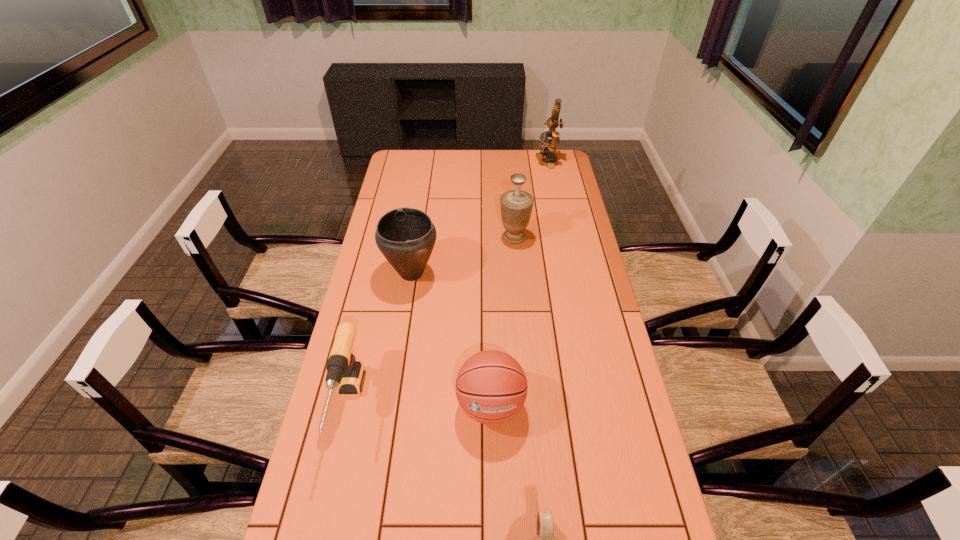
This screenshot has height=540, width=960. Find the location of `vacant space located on the front of the third tallest object`. vacant space located on the front of the third tallest object is located at coordinates (400, 344).

The height and width of the screenshot is (540, 960). Find the location of `free space located 0.100m on the logo side of the basketball`. free space located 0.100m on the logo side of the basketball is located at coordinates (492, 475).

In order to click on free space located 0.150m on the handle side of the drill in this screenshot , I will do `click(321, 523)`.

Find the location of a particular element. object that is at the far edge is located at coordinates (548, 149).

The image size is (960, 540). I want to click on urn that is positioned at the left edge, so click(405, 236).

Find the location of a particular element. This screenshot has height=540, width=960. drill positioned at the left edge is located at coordinates (343, 371).

Locate an element on the screen. object at the right edge is located at coordinates (548, 149).

Find the location of a particular element. The width and height of the screenshot is (960, 540). object that is at the far right corner is located at coordinates (548, 149).

At what (x,y) coordinates should I click in order to perform the action: click on free location at the far edge. Please return your answer as a coordinate pair (x, y). Looking at the image, I should click on (503, 150).

Locate an element on the screen. This screenshot has height=540, width=960. vacant area at the left edge is located at coordinates (375, 334).